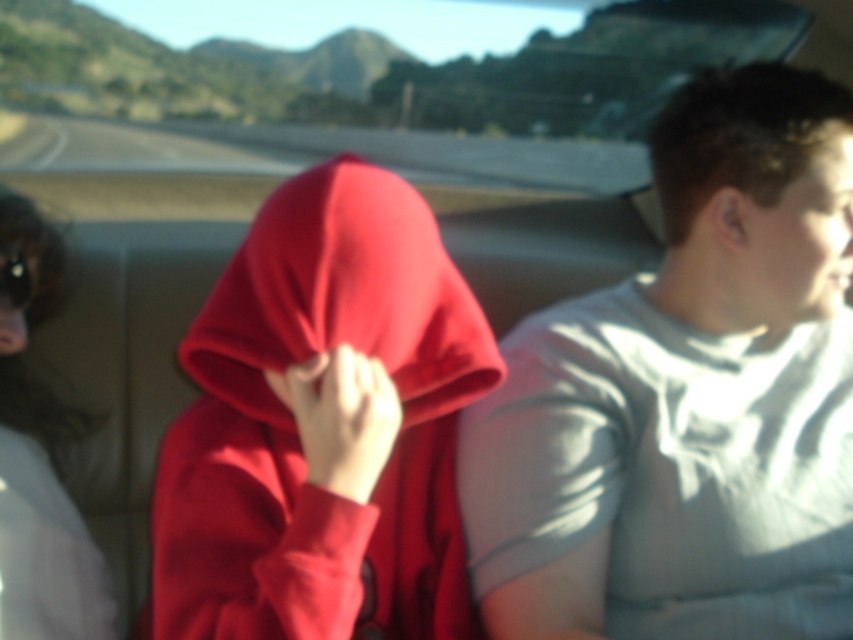
You are a passenger on a bus and you notice two items in the scene. The sunglasses at left and the matte black goggles at upper left. Which item is positioned further to the right?

The sunglasses at left are positioned to the right of the matte black goggles at upper left, so the sunglasses at left are further to the right.